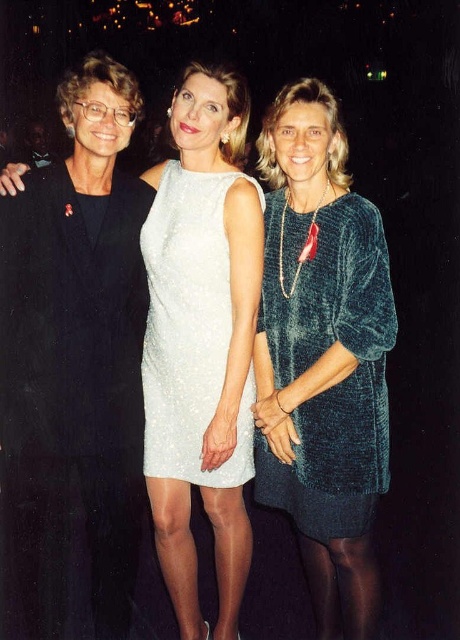
You are standing in front of the three women in the image. There are two points marked in the scene. One is at coordinate point (379, 432) and the other is at point (177, 298). Which point is closer to you?

Point (379, 432) is closer to the viewer than point (177, 298).

You are a photographer at a formal event. You need to adjust the lighting to ensure both the velvet green dress at center and the white sequined dress at center are visible. Which dress is positioned lower and might need more lighting adjustment?

The velvet green dress at center is below the white sequined dress at center, so it might need more lighting adjustment to ensure visibility.